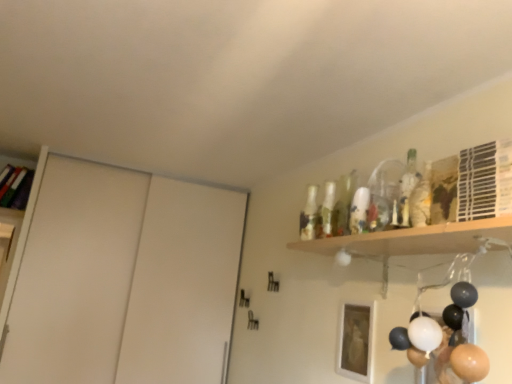
Question: Is white plastic shelf at upper right, which is counted as the 2th shelf, starting from the left, at the left side of wooden bookshelf at upper left, positioned as the 1th shelf in back-to-front order?

Choices:
 (A) no
 (B) yes

Answer: (A)

Question: From a real-world perspective, is white plastic shelf at upper right, which is the first shelf in right-to-left order, on top of wooden bookshelf at upper left, positioned as the 1th shelf in back-to-front order?

Choices:
 (A) no
 (B) yes

Answer: (A)

Question: Is white plastic shelf at upper right, the second shelf in the back-to-front sequence, oriented towards wooden bookshelf at upper left, positioned as the 1th shelf in back-to-front order?

Choices:
 (A) no
 (B) yes

Answer: (A)

Question: Is white plastic shelf at upper right, which is counted as the first shelf, starting from the front, oriented away from wooden bookshelf at upper left, the 2th shelf viewed from the front?

Choices:
 (A) no
 (B) yes

Answer: (A)

Question: Is white plastic shelf at upper right, which is counted as the 2th shelf, starting from the left, smaller than wooden bookshelf at upper left, which ranks as the second shelf in right-to-left order?

Choices:
 (A) yes
 (B) no

Answer: (A)

Question: Is white plastic shelf at upper right, which is counted as the first shelf, starting from the front, wider than wooden bookshelf at upper left, the 1th shelf viewed from the left?

Choices:
 (A) yes
 (B) no

Answer: (B)

Question: Is white matte sliding door at left at the right side of white matte picture frame at lower center?

Choices:
 (A) yes
 (B) no

Answer: (B)

Question: From a real-world perspective, does white matte sliding door at left stand above white matte picture frame at lower center?

Choices:
 (A) no
 (B) yes

Answer: (B)

Question: Is white matte sliding door at left bigger than white matte picture frame at lower center?

Choices:
 (A) yes
 (B) no

Answer: (A)

Question: Is white matte sliding door at left wider than white matte picture frame at lower center?

Choices:
 (A) no
 (B) yes

Answer: (B)

Question: Is white matte picture frame at lower center completely or partially inside white matte sliding door at left?

Choices:
 (A) no
 (B) yes

Answer: (A)

Question: Does white matte sliding door at left have a lesser width compared to white matte picture frame at lower center?

Choices:
 (A) yes
 (B) no

Answer: (B)

Question: Considering the relative sizes of white matte picture frame at lower center and matte black balloons at lower right in the image provided, is white matte picture frame at lower center shorter than matte black balloons at lower right?

Choices:
 (A) yes
 (B) no

Answer: (A)